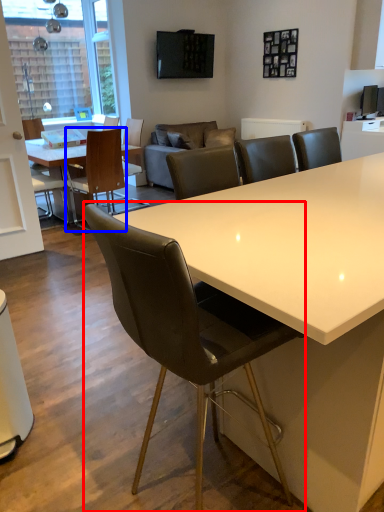
Question: Which point is closer to the camera, chair (highlighted by a red box) or chair (highlighted by a blue box)?

Choices:
 (A) chair
 (B) chair

Answer: (A)